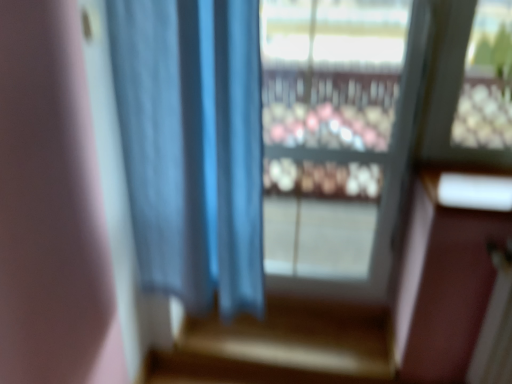
Question: Is transparent glass window at center wider or thinner than blue fabric curtain at center?

Choices:
 (A) wide
 (B) thin

Answer: (B)

Question: Is point (290, 281) positioned closer to the camera than point (183, 228)?

Choices:
 (A) closer
 (B) farther

Answer: (B)

Question: From a real-world perspective, is transparent glass window at center above or below blue fabric curtain at center?

Choices:
 (A) above
 (B) below

Answer: (B)

Question: In terms of width, does blue fabric curtain at center look wider or thinner when compared to transparent glass window at center?

Choices:
 (A) thin
 (B) wide

Answer: (B)

Question: From a real-world perspective, relative to transparent glass window at center, is blue fabric curtain at center vertically above or below?

Choices:
 (A) below
 (B) above

Answer: (B)

Question: From the image's perspective, is blue fabric curtain at center located above or below transparent glass window at center?

Choices:
 (A) above
 (B) below

Answer: (B)

Question: Is point (135, 135) positioned closer to the camera than point (401, 173)?

Choices:
 (A) closer
 (B) farther

Answer: (A)